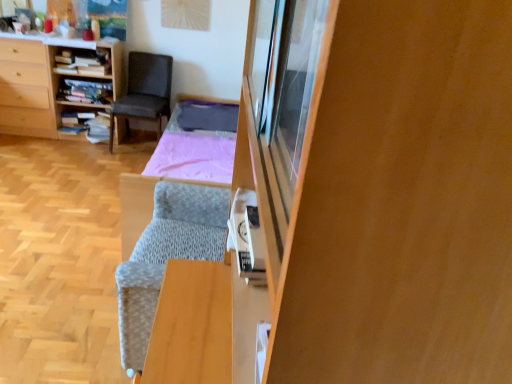
Find the location of a particular element. This screenshot has width=512, height=384. free area in between wooden bookshelf at left and wooden bookshelf at left, acting as the 1th shelf starting from the bottom is located at coordinates (36, 133).